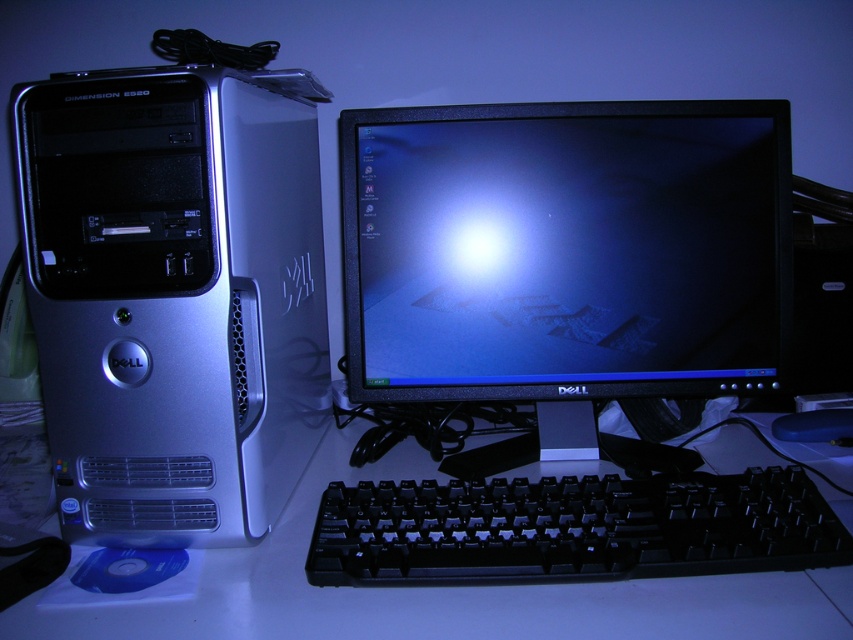
Does white plastic keyboard at lower center appear over black plastic keyboard at lower center?

No, white plastic keyboard at lower center is not above black plastic keyboard at lower center.

Between white plastic keyboard at lower center and black plastic keyboard at lower center, which one has less height?

black plastic keyboard at lower center is shorter.

The image size is (853, 640). What do you see at coordinates (433, 593) in the screenshot?
I see `white plastic keyboard at lower center` at bounding box center [433, 593].

Image resolution: width=853 pixels, height=640 pixels. Find the location of `white plastic keyboard at lower center`. white plastic keyboard at lower center is located at coordinates (433, 593).

Does point (474, 179) lie behind point (831, 419)?

No, it is not.

Can you confirm if black glossy monitor at center is shorter than black plastic mouse at lower right?

Incorrect, black glossy monitor at center's height does not fall short of black plastic mouse at lower right's.

This screenshot has height=640, width=853. What do you see at coordinates (566, 250) in the screenshot? I see `black glossy monitor at center` at bounding box center [566, 250].

At what (x,y) coordinates should I click in order to perform the action: click on black glossy monitor at center. Please return your answer as a coordinate pair (x, y). Looking at the image, I should click on (566, 250).

Is point (300, 333) positioned after point (782, 436)?

That is False.

Which of these two, satin silver computer tower at left or black plastic mouse at lower right, stands taller?

satin silver computer tower at left

Who is more distant from viewer, [254,324] or [851,426]?

Positioned behind is point [851,426].

Where is `satin silver computer tower at left`? The width and height of the screenshot is (853, 640). satin silver computer tower at left is located at coordinates (173, 298).